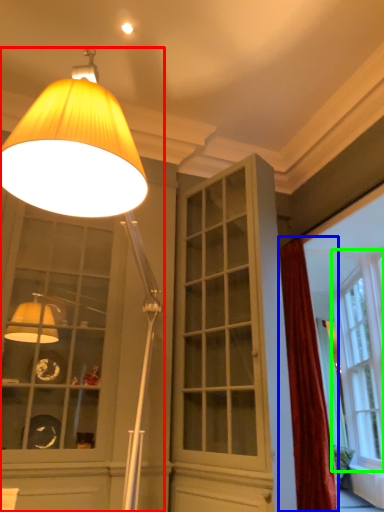
Question: Considering the real-world distances, which object is closest to lamp (highlighted by a red box)? curtain (highlighted by a blue box) or window (highlighted by a green box).

Choices:
 (A) curtain
 (B) window

Answer: (A)